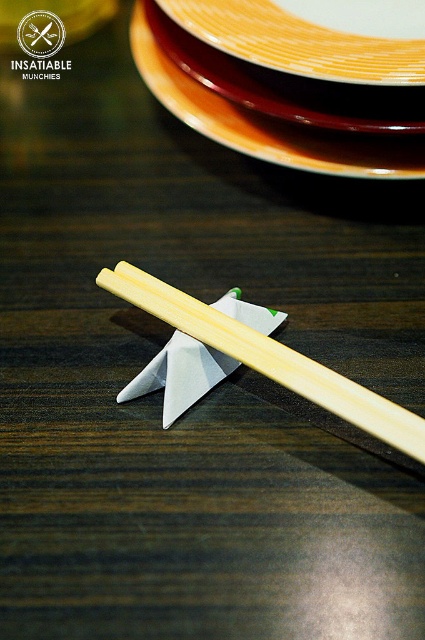
You are standing in a kitchen and want to reach the matte ceramic platter at upper center. If your outstretched hand can reach up to 4 feet, will you be able to touch it?

The matte ceramic platter at upper center is 4.59 feet away from the viewer. Since your hand can only reach up to 4 feet, you cannot touch it.